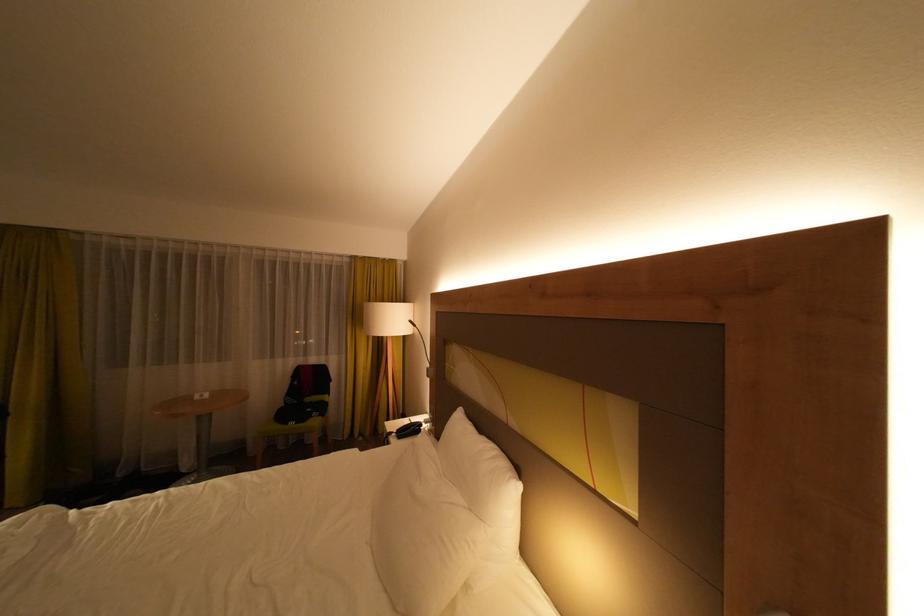
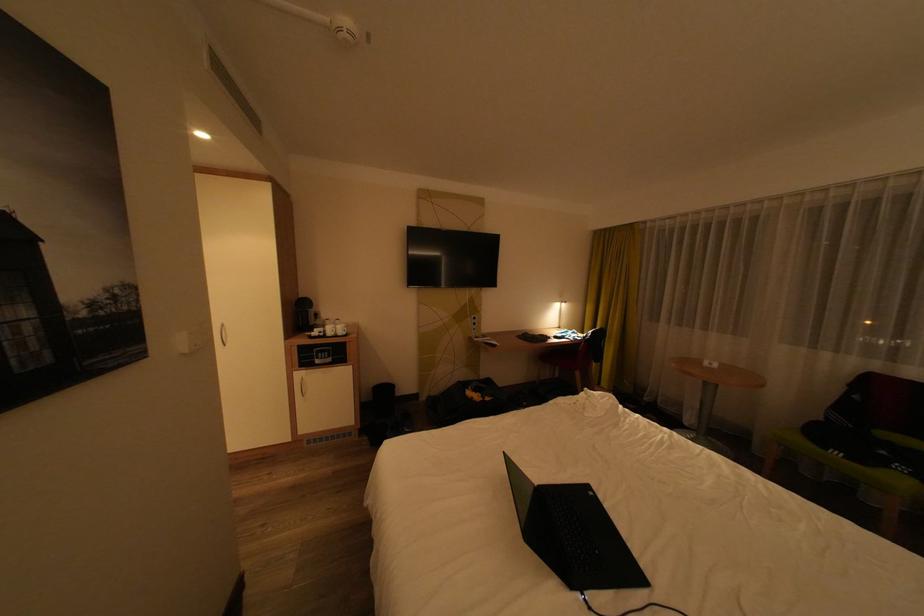
In the second image, find the point that corresponds to (x=294, y=406) in the first image.

(833, 419)